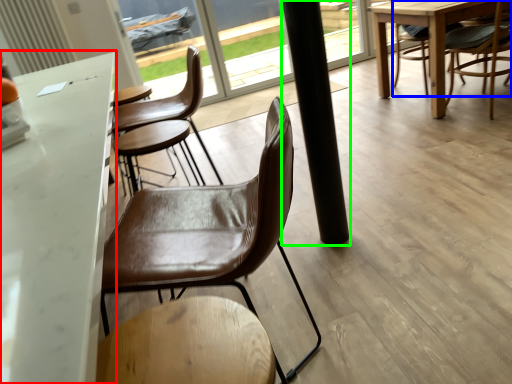
Question: Estimate the real-world distances between objects in this image. Which object is closer to table (highlighted by a red box), chair (highlighted by a blue box) or pillar (highlighted by a green box)?

Choices:
 (A) chair
 (B) pillar

Answer: (B)